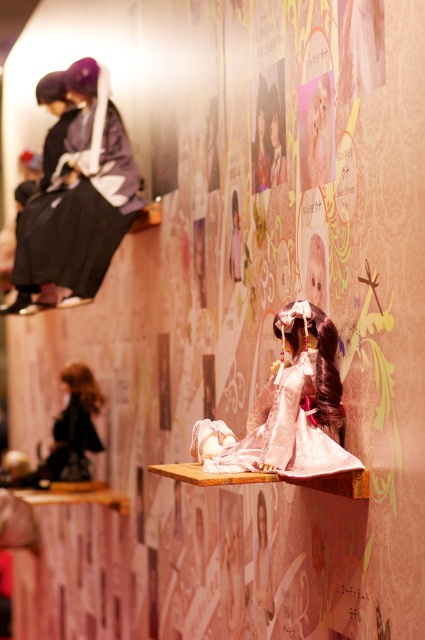
Which is more to the left, matte black kimono at upper left or satin pink dress at center?

From the viewer's perspective, matte black kimono at upper left appears more on the left side.

Who is higher up, matte black kimono at upper left or satin pink dress at center?

matte black kimono at upper left is above.

The width and height of the screenshot is (425, 640). Identify the location of matte black kimono at upper left. (81, 195).